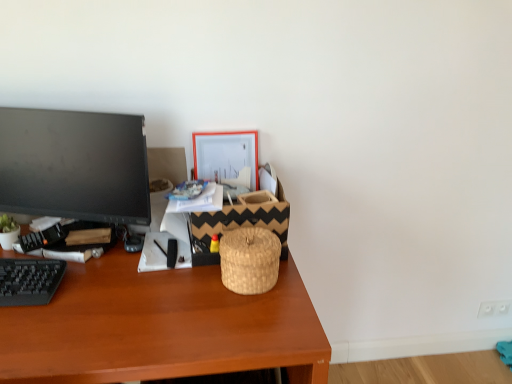
At what (x,y) coordinates should I click in order to perform the action: click on vacant space that's between black plastic keyboard at lower left and woven natural basket at center, the first basket in the front-to-back sequence. Please return your answer as a coordinate pair (x, y). The image size is (512, 384). Looking at the image, I should click on (131, 288).